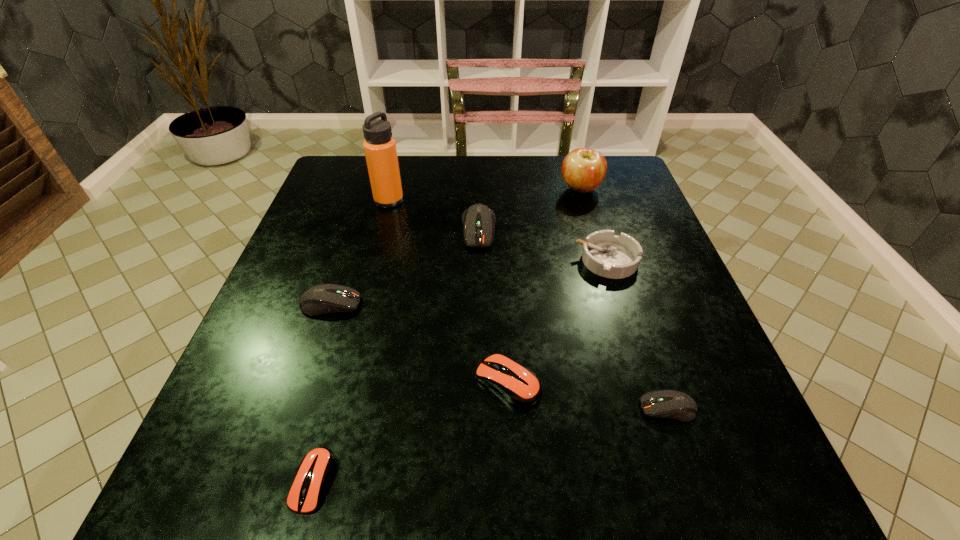
In order to click on vacant space located on the button of the rightmost dark computer equipment in this screenshot , I will do `click(517, 408)`.

At what (x,y) coordinates should I click in order to perform the action: click on vacant region located on the button of the rightmost dark computer equipment. Please return your answer as a coordinate pair (x, y). This screenshot has height=540, width=960. Looking at the image, I should click on point(517,408).

The image size is (960, 540). I want to click on free space located on the button of the rightmost dark computer equipment, so click(x=586, y=408).

In order to click on vacant space situated 0.160m on the left of the shortest object in this screenshot , I will do `click(183, 481)`.

Locate an element on the screen. This screenshot has height=540, width=960. thermos bottle located in the far edge section of the desktop is located at coordinates (380, 149).

Locate an element on the screen. This screenshot has width=960, height=540. apple that is at the far edge is located at coordinates (583, 170).

Locate an element on the screen. The image size is (960, 540). object situated at the near edge is located at coordinates (315, 469).

The height and width of the screenshot is (540, 960). I want to click on thermos bottle at the left edge, so click(x=380, y=149).

Identify the location of apple that is at the right edge. (583, 170).

Find the location of a particular element. ashtray at the right edge is located at coordinates (611, 256).